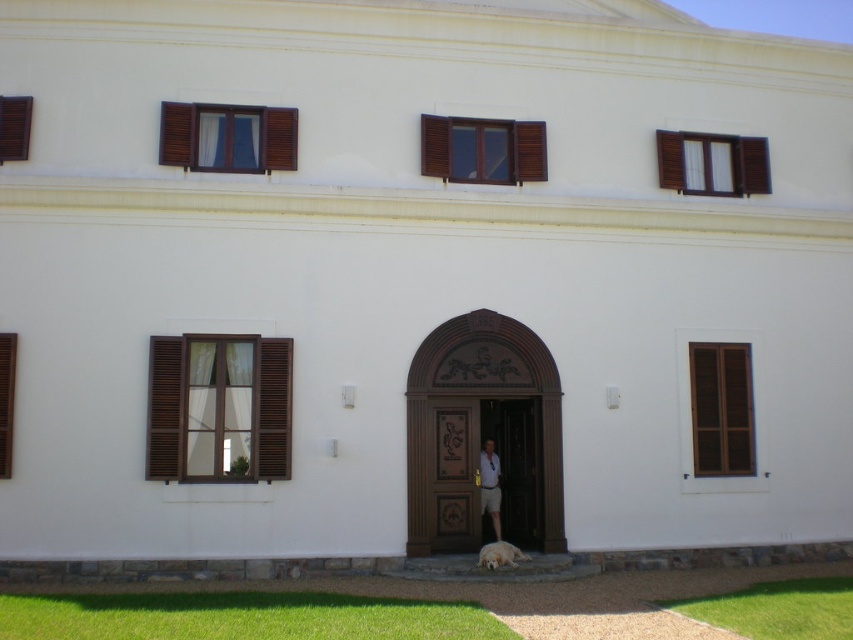
Question: Which point appears closest to the camera in this image?

Choices:
 (A) (22, 115)
 (B) (492, 566)
 (C) (527, 332)
 (D) (708, 460)

Answer: (B)

Question: Can you confirm if brown wooden shutters at upper left is bigger than wooden carved door at center?

Choices:
 (A) yes
 (B) no

Answer: (B)

Question: Is brown wooden shutter at left bigger than light blue shirt at center?

Choices:
 (A) yes
 (B) no

Answer: (B)

Question: Which of these objects is positioned closest to the golden fur dog at lower center?

Choices:
 (A) light blue shirt at center
 (B) brown wooden shutters at left
 (C) wooden door at center
 (D) brown wooden shutter at left

Answer: (A)

Question: Which point is closer to the camera taking this photo?

Choices:
 (A) (747, 376)
 (B) (3, 465)

Answer: (B)

Question: Where is wooden carved door at center located in relation to brown wooden shutter at left in the image?

Choices:
 (A) below
 (B) above

Answer: (A)